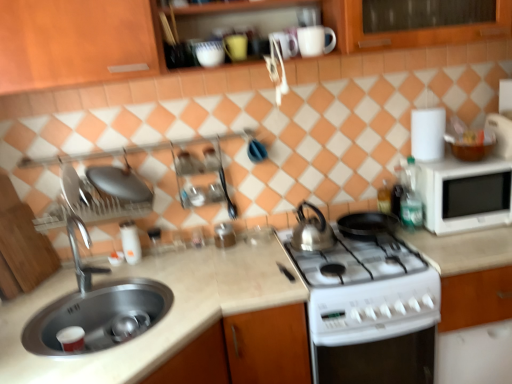
Identify the location of free location in front of metallic silver canister at center, positioned as the 2th appliance in left-to-right order. (232, 253).